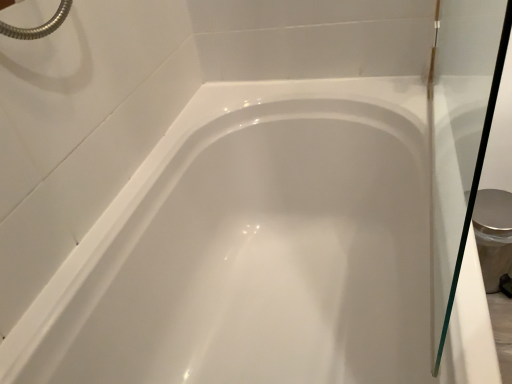
Image resolution: width=512 pixels, height=384 pixels. I want to click on empty space that is ontop of silver metallic toilet bowl at right, so click(489, 198).